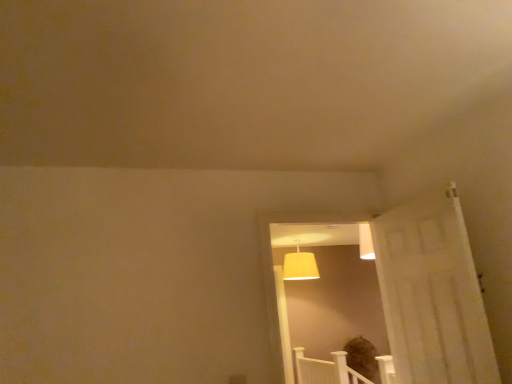
Describe the element at coordinates (300, 265) in the screenshot. I see `yellow fabric lampshade at upper center` at that location.

You are a GUI agent. You are given a task and a screenshot of the screen. Output one action in this format:
    pyautogui.click(x=<x>, y=<y>)
    Task: Click on the yellow fabric lampshade at upper center
    
    Given the screenshot: What is the action you would take?
    pyautogui.click(x=300, y=265)

The height and width of the screenshot is (384, 512). What do you see at coordinates (326, 293) in the screenshot?
I see `matte white door at center` at bounding box center [326, 293].

The image size is (512, 384). Identify the location of matte white door at center. (326, 293).

The image size is (512, 384). Identify the location of yellow fabric lampshade at upper center. (300, 265).

Considering the positions of objects matte white door at center and yellow fabric lampshade at upper center in the image provided, who is more to the left, matte white door at center or yellow fabric lampshade at upper center?

matte white door at center.

Is matte white door at center closer to the viewer compared to yellow fabric lampshade at upper center?

Yes, matte white door at center is closer to the viewer.

Is point (371, 266) positioned after point (307, 257)?

Yes.

From the image's perspective, which one is positioned lower, matte white door at center or yellow fabric lampshade at upper center?

yellow fabric lampshade at upper center.

From a real-world perspective, is matte white door at center above or below yellow fabric lampshade at upper center?

Clearly, from a real-world perspective, matte white door at center is below yellow fabric lampshade at upper center.

Considering the sizes of matte white door at center and yellow fabric lampshade at upper center in the image, is matte white door at center wider or thinner than yellow fabric lampshade at upper center?

matte white door at center is thinner than yellow fabric lampshade at upper center.

Considering the sizes of matte white door at center and yellow fabric lampshade at upper center in the image, is matte white door at center taller or shorter than yellow fabric lampshade at upper center?

Considering their sizes, matte white door at center has more height than yellow fabric lampshade at upper center.

Looking at this image, considering the sizes of objects matte white door at center and yellow fabric lampshade at upper center in the image provided, who is bigger, matte white door at center or yellow fabric lampshade at upper center?

Bigger between the two is matte white door at center.

Is matte white door at center completely or partially outside of yellow fabric lampshade at upper center?

Yes, matte white door at center is outside of yellow fabric lampshade at upper center.

Is matte white door at center in contact with yellow fabric lampshade at upper center?

No, matte white door at center is not touching yellow fabric lampshade at upper center.

Is matte white door at center facing towards yellow fabric lampshade at upper center?

No, matte white door at center is not oriented towards yellow fabric lampshade at upper center.

Looking at this image, how different are the orientations of matte white door at center and yellow fabric lampshade at upper center in degrees?

They differ by 0.382 degrees in their facing directions.

In the image, there is a matte white door at center. At what (x,y) coordinates should I click in order to perform the action: click on lamp below it (from the image's perspective). Please return your answer as a coordinate pair (x, y). Looking at the image, I should click on (300, 265).

Which is more to the right, yellow fabric lampshade at upper center or matte white door at center?

yellow fabric lampshade at upper center.

Relative to matte white door at center, is yellow fabric lampshade at upper center in front or behind?

Clearly, yellow fabric lampshade at upper center is behind matte white door at center.

Does point (300, 254) appear closer or farther from the camera than point (358, 334)?

Point (300, 254) is positioned farther from the camera compared to point (358, 334).

From the image's perspective, which one is positioned higher, yellow fabric lampshade at upper center or matte white door at center?

From the image's view, matte white door at center is above.

From a real-world perspective, between yellow fabric lampshade at upper center and matte white door at center, who is vertically lower?

From a 3D spatial view, matte white door at center is below.

Which of these two, yellow fabric lampshade at upper center or matte white door at center, is thinner?

Thinner between the two is matte white door at center.

Which of these two, yellow fabric lampshade at upper center or matte white door at center, stands taller?

matte white door at center.

Which of these two, yellow fabric lampshade at upper center or matte white door at center, is smaller?

With smaller size is yellow fabric lampshade at upper center.

From the picture: Can matte white door at center be found inside yellow fabric lampshade at upper center?

No, matte white door at center is not a part of yellow fabric lampshade at upper center.

Is yellow fabric lampshade at upper center in contact with matte white door at center?

No, yellow fabric lampshade at upper center is not with matte white door at center.

Is yellow fabric lampshade at upper center facing towards matte white door at center?

Yes, yellow fabric lampshade at upper center is facing matte white door at center.

How many degrees apart are the facing directions of yellow fabric lampshade at upper center and matte white door at center?

The facing directions of yellow fabric lampshade at upper center and matte white door at center are 0.382 degrees apart.

Find the location of a particular element. This screenshot has width=512, height=384. lamp located on the right of matte white door at center is located at coordinates (300, 265).

Where is `window lying in front of the yellow fabric lampshade at upper center`? The image size is (512, 384). window lying in front of the yellow fabric lampshade at upper center is located at coordinates (326, 293).

Locate an element on the screen. The image size is (512, 384). lamp that is above the matte white door at center (from a real-world perspective) is located at coordinates (300, 265).